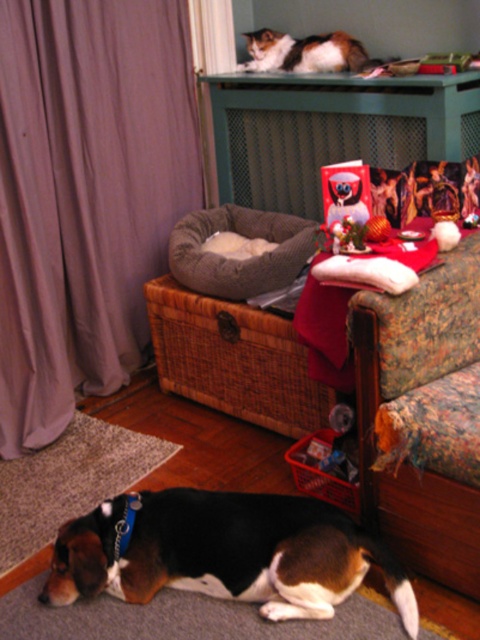
Question: Estimate the real-world distances between objects in this image. Which object is closer to the calico fur cat at upper center?

Choices:
 (A) gray plush dog bed at center
 (B) brown and white fur at lower left
 (C) purple fabric curtain at left
 (D) floral fabric couch at lower right

Answer: (A)

Question: Which of the following is the closest to the observer?

Choices:
 (A) (420, 282)
 (B) (252, 35)
 (C) (280, 554)
 (D) (360, 220)

Answer: (C)

Question: Does gray plush dog bed at center appear over calico fur cat at upper center?

Choices:
 (A) no
 (B) yes

Answer: (A)

Question: Does brown and white fur at lower left have a lesser width compared to floral fabric couch at lower right?

Choices:
 (A) no
 (B) yes

Answer: (A)

Question: Can you confirm if brown and white fur at lower left is bigger than gray plush dog bed at center?

Choices:
 (A) yes
 (B) no

Answer: (B)

Question: Which point appears farthest from the camera in this image?

Choices:
 (A) (206, 560)
 (B) (342, 173)

Answer: (B)